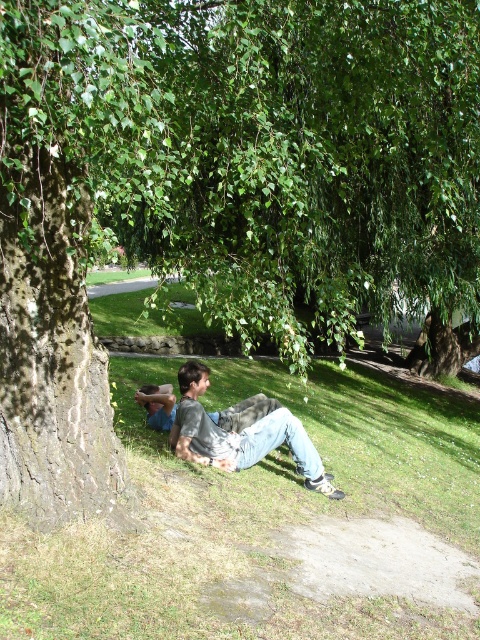
Does green grass at lower center have a lesser width compared to gray cotton shirt at center?

In fact, green grass at lower center might be wider than gray cotton shirt at center.

Does green grass at lower center have a larger size compared to gray cotton shirt at center?

Indeed, green grass at lower center has a larger size compared to gray cotton shirt at center.

Identify the location of green grass at lower center. This screenshot has height=640, width=480. click(x=271, y=524).

Identify the location of green grass at lower center. This screenshot has height=640, width=480. (271, 524).